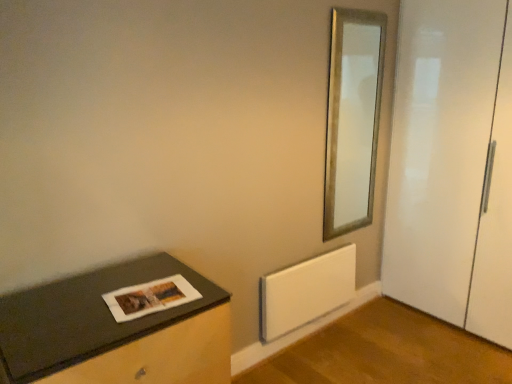
In order to face white matte radiator at lower center, should I rotate leftwards or rightwards?

A 8.120 degree turn to the right will do.

This screenshot has height=384, width=512. Describe the element at coordinates (116, 330) in the screenshot. I see `dark gray matte table at lower left` at that location.

This screenshot has width=512, height=384. What are the coordinates of `white matte radiator at lower center` in the screenshot? It's located at (306, 291).

Are white matte radiator at lower center and white glossy door at right far apart?

They are positioned close to each other.

Considering the sizes of objects white matte radiator at lower center and white glossy door at right in the image provided, who is shorter, white matte radiator at lower center or white glossy door at right?

Standing shorter between the two is white matte radiator at lower center.

From the image's perspective, is white matte radiator at lower center on top of white glossy door at right?

No, from the image's perspective, white matte radiator at lower center is not on top of white glossy door at right.

In the scene shown: From a real-world perspective, is white glossy door at right positioned over white matte radiator at lower center based on gravity?

Yes, from a real-world perspective, white glossy door at right is on top of white matte radiator at lower center.

Looking at this image, between white glossy door at right and white matte radiator at lower center, which one appears on the left side from the viewer's perspective?

white matte radiator at lower center is more to the left.

Is white glossy door at right not within white matte radiator at lower center?

Yes, white glossy door at right is not within white matte radiator at lower center.

Looking at the image, does matte paper magazine at lower left seem bigger or smaller compared to gold metallic mirror at upper right?

In the image, matte paper magazine at lower left appears to be smaller than gold metallic mirror at upper right.

You are a GUI agent. You are given a task and a screenshot of the screen. Output one action in this format:
    pyautogui.click(x=<x>, y=<y>)
    Task: Click on the magazine below the gold metallic mirror at upper right (from a real-world perspective)
    This screenshot has height=384, width=512.
    Given the screenshot: What is the action you would take?
    pyautogui.click(x=150, y=298)

Is gold metallic mirror at upper right located within matte paper magazine at lower left?

No, gold metallic mirror at upper right is not surrounded by matte paper magazine at lower left.

Does point (129, 311) lie in front of point (345, 160)?

That is True.

Are matte paper magazine at lower left and dark gray matte table at lower left located far from each other?

No, matte paper magazine at lower left is in close proximity to dark gray matte table at lower left.

From a real-world perspective, is matte paper magazine at lower left beneath dark gray matte table at lower left?

Actually, matte paper magazine at lower left is physically above dark gray matte table at lower left in the real world.

Which of these two, matte paper magazine at lower left or dark gray matte table at lower left, is wider?

Wider between the two is dark gray matte table at lower left.

Identify the location of mirror located above the white glossy door at right (from the image's perspective). This screenshot has width=512, height=384. (352, 119).

Is the position of white glossy door at right less distant than that of gold metallic mirror at upper right?

That is True.

Measure the distance from white glossy door at right to gold metallic mirror at upper right.

white glossy door at right is 17.05 inches away from gold metallic mirror at upper right.

Find the location of `magazine lying above the white matte radiator at lower center (from the image's perspective)`. magazine lying above the white matte radiator at lower center (from the image's perspective) is located at coordinates (150, 298).

From a real-world perspective, is white matte radiator at lower center below matte paper magazine at lower left?

Indeed, from a real-world perspective, white matte radiator at lower center is positioned beneath matte paper magazine at lower left.

Visually, is white matte radiator at lower center positioned to the left or to the right of matte paper magazine at lower left?

Based on their positions, white matte radiator at lower center is located to the right of matte paper magazine at lower left.

Considering the positions of objects white matte radiator at lower center and matte paper magazine at lower left in the image provided, who is behind, white matte radiator at lower center or matte paper magazine at lower left?

white matte radiator at lower center is further away from the camera.

Is matte paper magazine at lower left bigger than white matte radiator at lower center?

Actually, matte paper magazine at lower left might be smaller than white matte radiator at lower center.

Where is `magazine above the white matte radiator at lower center (from the image's perspective)`? This screenshot has height=384, width=512. magazine above the white matte radiator at lower center (from the image's perspective) is located at coordinates (150, 298).

Does matte paper magazine at lower left have a lesser height compared to white matte radiator at lower center?

Indeed, matte paper magazine at lower left has a lesser height compared to white matte radiator at lower center.

Find the location of `radiator below the white glossy door at right (from a real-world perspective)`. radiator below the white glossy door at right (from a real-world perspective) is located at coordinates (306, 291).

I want to click on radiator that is on the left side of white glossy door at right, so click(x=306, y=291).

Based on their spatial positions, is matte paper magazine at lower left or white glossy door at right further from white matte radiator at lower center?

matte paper magazine at lower left is positioned further to the anchor white matte radiator at lower center.

Based on their spatial positions, is white glossy door at right or dark gray matte table at lower left further from matte paper magazine at lower left?

white glossy door at right.

Looking at this image, estimate the real-world distances between objects in this image. Which object is further from matte paper magazine at lower left, white matte radiator at lower center or dark gray matte table at lower left?

white matte radiator at lower center lies further to matte paper magazine at lower left than the other object.

From the picture: Estimate the real-world distances between objects in this image. Which object is closer to matte paper magazine at lower left, white matte radiator at lower center or white glossy door at right?

white matte radiator at lower center is closer to matte paper magazine at lower left.

Looking at the image, which one is located further to white glossy door at right, dark gray matte table at lower left or matte paper magazine at lower left?

Based on the image, dark gray matte table at lower left appears to be further to white glossy door at right.

Based on the photo, when comparing their distances from white glossy door at right, does matte paper magazine at lower left or white matte radiator at lower center seem further?

Based on the image, matte paper magazine at lower left appears to be further to white glossy door at right.

From the image, which object appears to be farther from dark gray matte table at lower left, matte paper magazine at lower left or white matte radiator at lower center?

white matte radiator at lower center is positioned further to the anchor dark gray matte table at lower left.

From the image, which object appears to be farther from gold metallic mirror at upper right, white matte radiator at lower center or matte paper magazine at lower left?

matte paper magazine at lower left is positioned further to the anchor gold metallic mirror at upper right.

Where is `mirror situated between dark gray matte table at lower left and white glossy door at right from left to right`? mirror situated between dark gray matte table at lower left and white glossy door at right from left to right is located at coordinates (352, 119).

Locate an element on the screen. mirror between dark gray matte table at lower left and white matte radiator at lower center in the front-back direction is located at coordinates point(352,119).

Where is `magazine between dark gray matte table at lower left and white matte radiator at lower center in the front-back direction`? magazine between dark gray matte table at lower left and white matte radiator at lower center in the front-back direction is located at coordinates (150, 298).

This screenshot has height=384, width=512. Find the location of `mirror between matte paper magazine at lower left and white glossy door at right in the horizontal direction`. mirror between matte paper magazine at lower left and white glossy door at right in the horizontal direction is located at coordinates (352, 119).